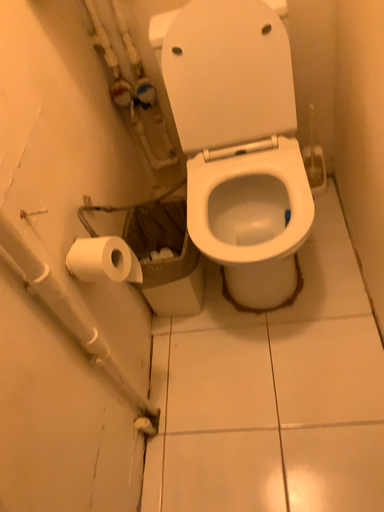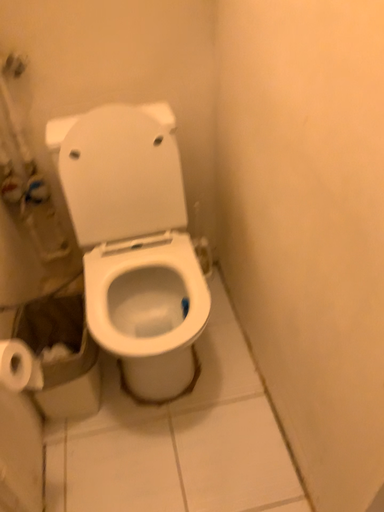
Question: How did the camera likely rotate when shooting the video?

Choices:
 (A) rotated downward
 (B) rotated upward

Answer: (B)